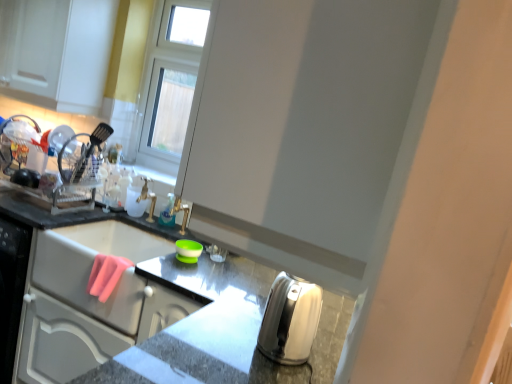
This screenshot has width=512, height=384. Find the location of `free location in front of satin silver kettle at lower right, the 2th appliance from the left`. free location in front of satin silver kettle at lower right, the 2th appliance from the left is located at coordinates (243, 372).